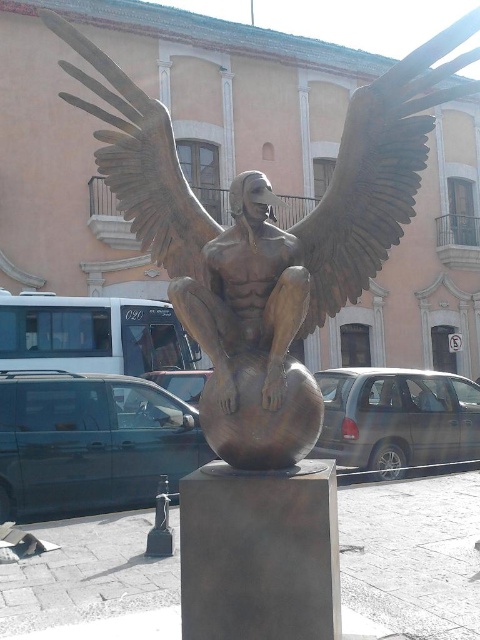
Does bronze wing at upper center appear on the left side of bronze wings at upper left?

No, bronze wing at upper center is not to the left of bronze wings at upper left.

Is bronze wing at upper center positioned behind bronze wings at upper left?

No, bronze wing at upper center is closer to the viewer.

Does point (365, 240) come in front of point (135, 208)?

Yes.

Find the location of a particular element. This screenshot has width=480, height=640. bronze wing at upper center is located at coordinates (376, 172).

Can you confirm if bronze statue at center is thinner than bronze wings at upper left?

No.

Who is more distant from viewer, (x=264, y=320) or (x=177, y=227)?

The point (x=177, y=227) is more distant.

This screenshot has width=480, height=640. I want to click on bronze statue at center, so click(x=268, y=237).

Between bronze statue at center and bronze wing at upper center, which one appears on the left side from the viewer's perspective?

Positioned to the left is bronze statue at center.

Is bronze statue at center behind bronze wing at upper center?

No.

The height and width of the screenshot is (640, 480). What are the coordinates of `bronze statue at center` in the screenshot? It's located at (268, 237).

Identify the location of bronze statue at center. (268, 237).